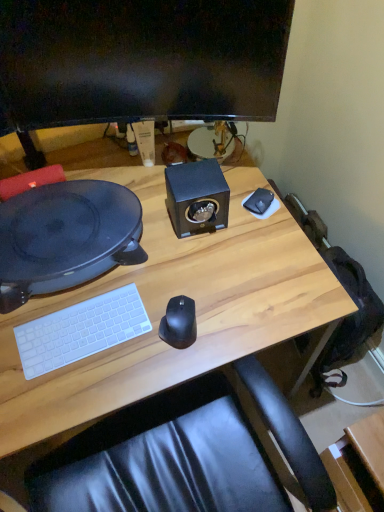
Find the location of `free region on the left part of white matte mousepad at upper right`. free region on the left part of white matte mousepad at upper right is located at coordinates (202, 226).